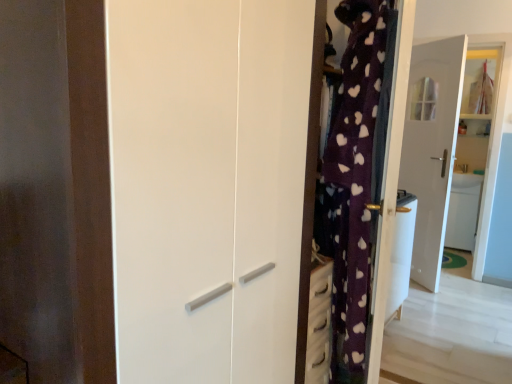
Question: From a real-world perspective, is white glossy wardrobe at center above or below white glossy sink at right?

Choices:
 (A) above
 (B) below

Answer: (A)

Question: Is white glossy wardrobe at center wider or thinner than white glossy sink at right?

Choices:
 (A) thin
 (B) wide

Answer: (B)

Question: Considering the real-world distances, which object is closest to the white glossy door at center?

Choices:
 (A) white glossy wardrobe at center
 (B) white glossy sink at right

Answer: (B)

Question: Based on their relative distances, which object is nearer to the white glossy door at center?

Choices:
 (A) white glossy sink at right
 (B) white glossy wardrobe at center

Answer: (A)